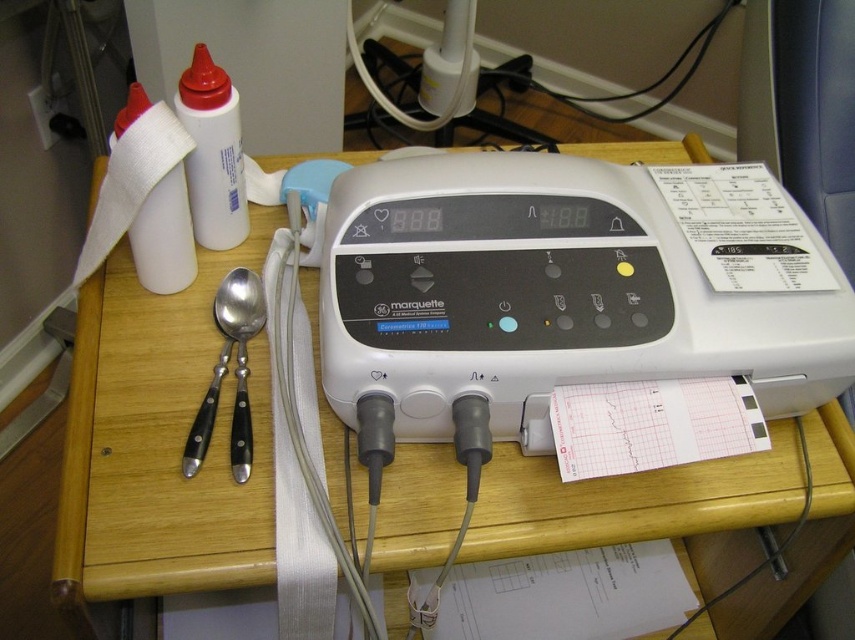
Question: Considering the real-world distances, which object is closest to the white plastic bottle at upper left?

Choices:
 (A) white matte bottle at upper left
 (B) black plastic plug at upper left
 (C) wooden table at center

Answer: (A)

Question: Is wooden table at center wider than white plastic bottle at upper left?

Choices:
 (A) yes
 (B) no

Answer: (A)

Question: Based on their relative distances, which object is farther from the wooden table at center?

Choices:
 (A) black plastic plug at upper left
 (B) white matte bottle at upper left

Answer: (A)

Question: From the image, what is the correct spatial relationship of wooden table at center in relation to black plastic plug at upper left?

Choices:
 (A) right
 (B) left

Answer: (A)

Question: Among these points, which one is nearest to the camera?

Choices:
 (A) (390, 520)
 (B) (140, 241)

Answer: (A)

Question: Is wooden table at center thinner than black plastic plug at upper left?

Choices:
 (A) yes
 (B) no

Answer: (B)